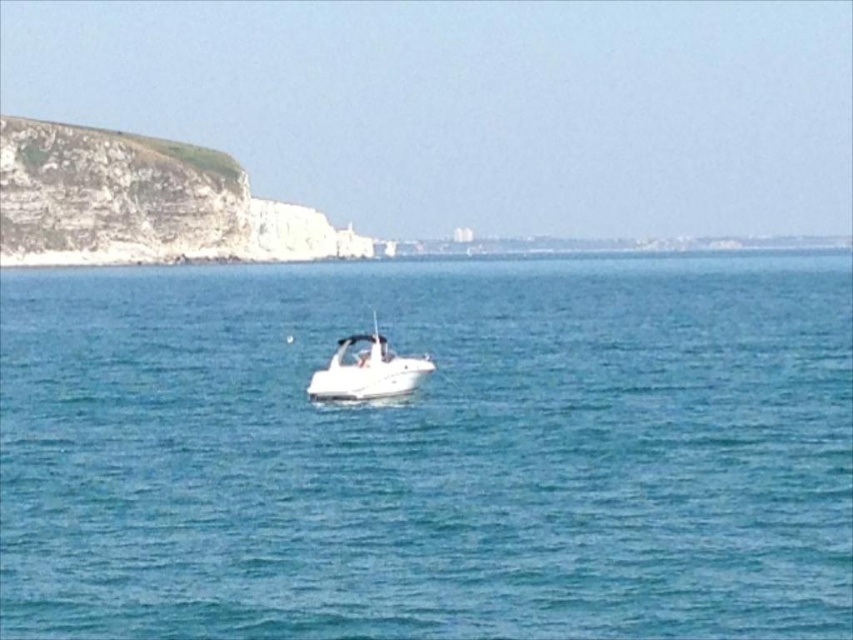
Question: Does clear blue water at center appear over white glossy boat at center?

Choices:
 (A) yes
 (B) no

Answer: (A)

Question: Which object is the closest to the white rocky cliff at upper left?

Choices:
 (A) white glossy boat at center
 (B) clear blue water at center

Answer: (B)

Question: Is clear blue water at center positioned before white glossy boat at center?

Choices:
 (A) no
 (B) yes

Answer: (B)

Question: Which object is positioned closest to the white glossy boat at center?

Choices:
 (A) white rocky cliff at upper left
 (B) clear blue water at center

Answer: (B)

Question: Does clear blue water at center have a smaller size compared to white rocky cliff at upper left?

Choices:
 (A) yes
 (B) no

Answer: (B)

Question: Which object is the farthest from the white rocky cliff at upper left?

Choices:
 (A) white glossy boat at center
 (B) clear blue water at center

Answer: (A)